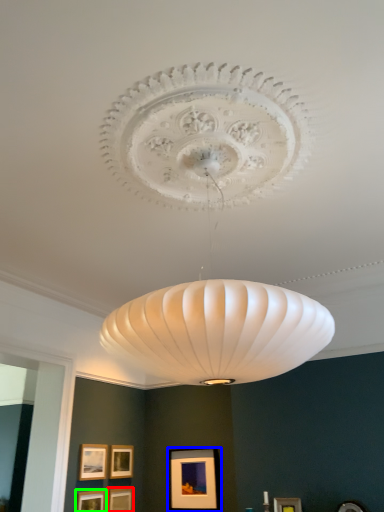
Question: Based on their relative distances, which object is farther from picture frame (highlighted by a red box)? Choose from picture frame (highlighted by a blue box) and picture frame (highlighted by a green box).

Choices:
 (A) picture frame
 (B) picture frame

Answer: (A)